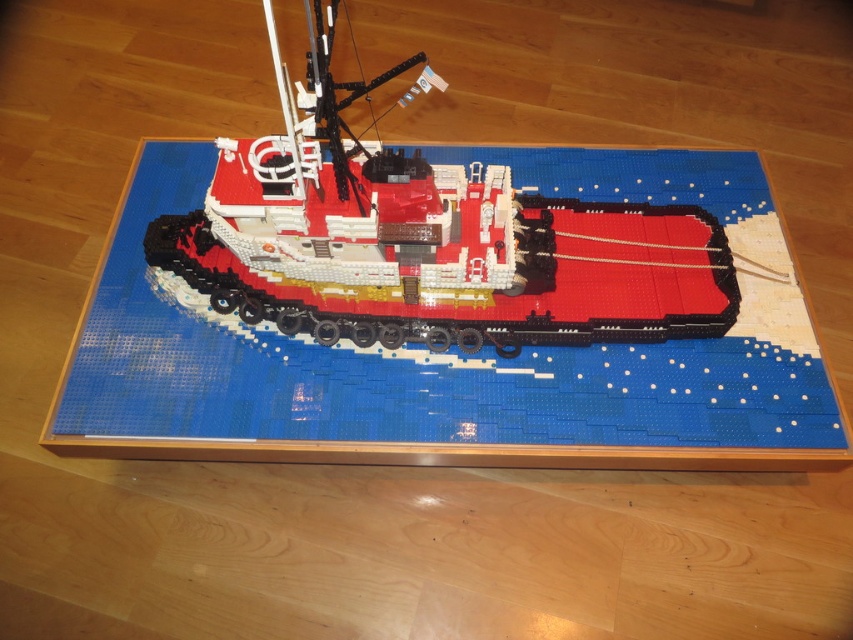
You are arranging a LEGO display and notice the blue plastic table at center and the brick red plastic tugboat at center. Which object is positioned to the right side of the other?

The blue plastic table at center is to the left of the brick red plastic tugboat at center, so the brick red plastic tugboat at center is positioned to the right side of the blue plastic table at center.

Consider the image. You are a toy organizer who needs to store the brick red plastic tugboat at center on a shelf. The shelf has a height limit of 10 cm. Can you determine if the blue plastic table at center, which is part of the display, will fit on the same shelf without exceeding the height limit?

The blue plastic table at center is much taller than the brick red plastic tugboat at center. Since the shelf has a height limit of 10 cm, and the table is taller than the tugboat, it is possible that the table exceeds the height limit. However, without knowing the exact height of the tugboat, we cannot definitively determine if the table will fit. Please check the actual dimensions.